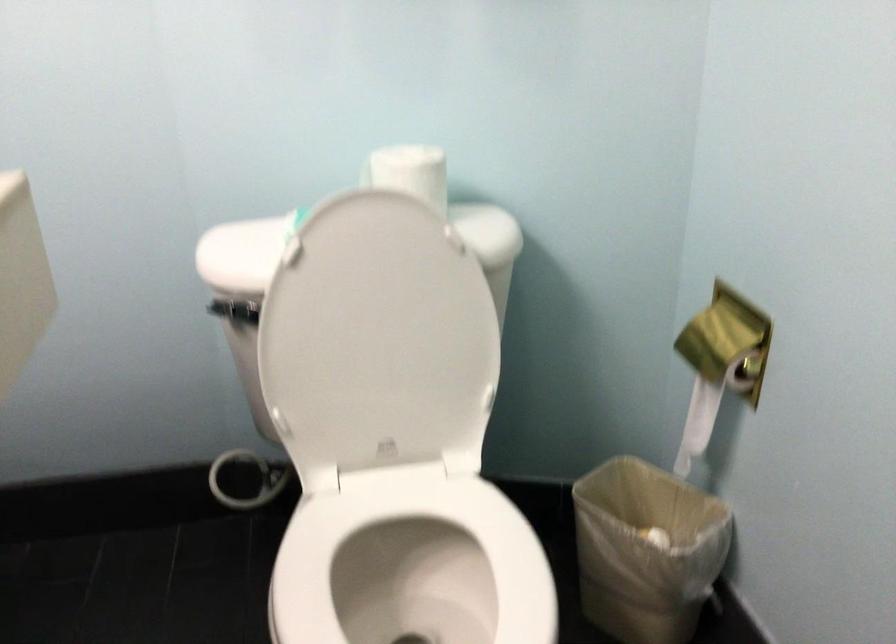
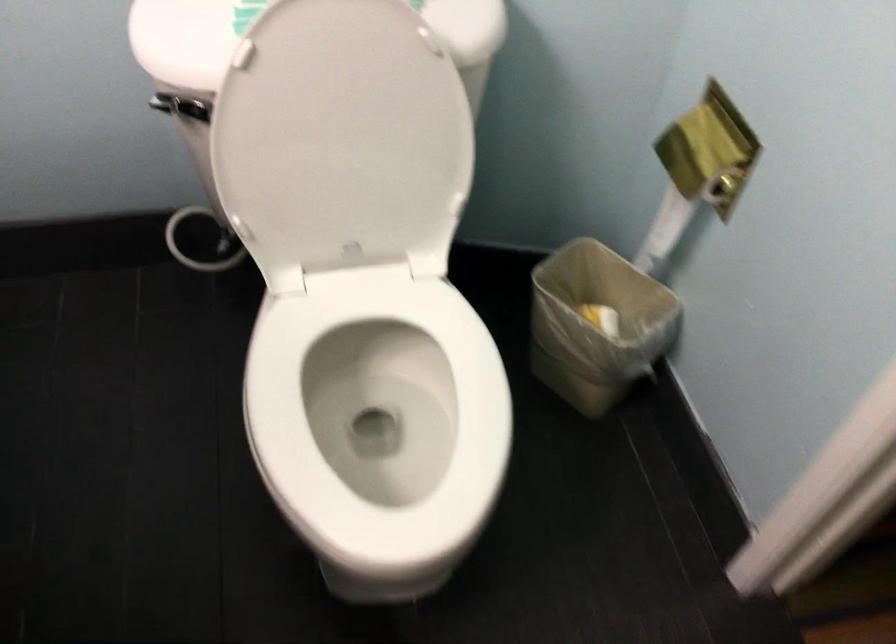
Which direction would the cameraman need to move to produce the second image?

The movement direction of the cameraman is left, forward.